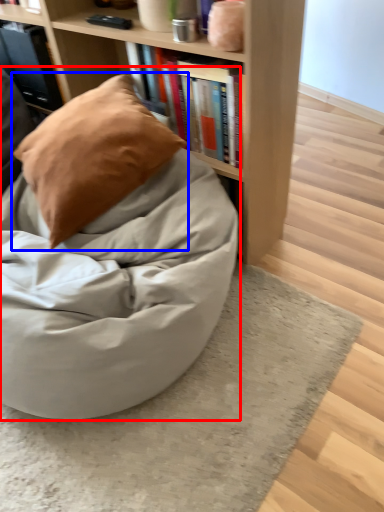
Question: Which object appears closest to the camera in this image, bean bag chair (highlighted by a red box) or pillow (highlighted by a blue box)?

Choices:
 (A) bean bag chair
 (B) pillow

Answer: (A)